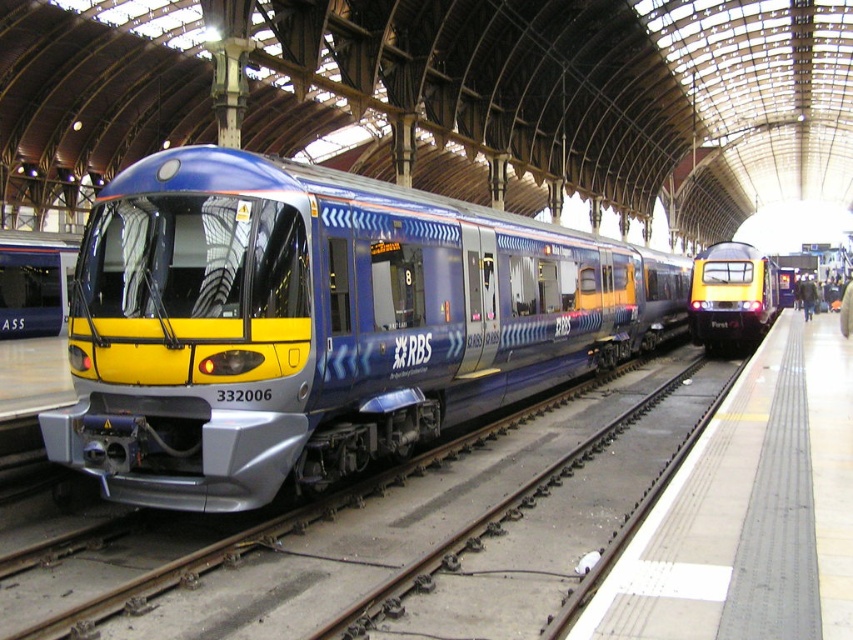
You are standing at the entrance of the train station and want to walk to the metallic train track at center. Which direction should you walk to reach it?

Walk towards the center of the platform to reach the metallic train track at center.

Based on the photo, you are a maintenance worker inspecting the train station. You need to measure the distance between the metallic blue train at center and the metallic train track at center. Can you determine which one is longer in length?

The metallic blue train at center has a larger size compared to the metallic train track at center, so the metallic blue train at center is longer in length.